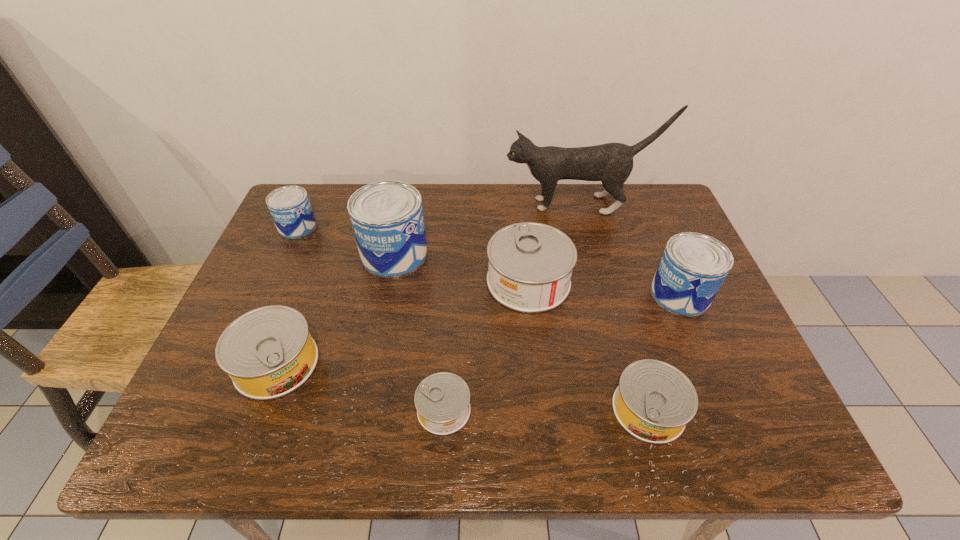
Image resolution: width=960 pixels, height=540 pixels. I want to click on free spot that satisfies the following two spatial constraints: 1. on the back side of the rightmost silver can; 2. on the left side of the smallest silver can, so click(444, 410).

The width and height of the screenshot is (960, 540). Identify the location of vacant space that satisfies the following two spatial constraints: 1. on the front label of the leftmost blue can; 2. on the right side of the second biggest silver can. (236, 363).

I want to click on free space that satisfies the following two spatial constraints: 1. on the back side of the shortest can; 2. on the right side of the biggest silver can, so click(x=452, y=281).